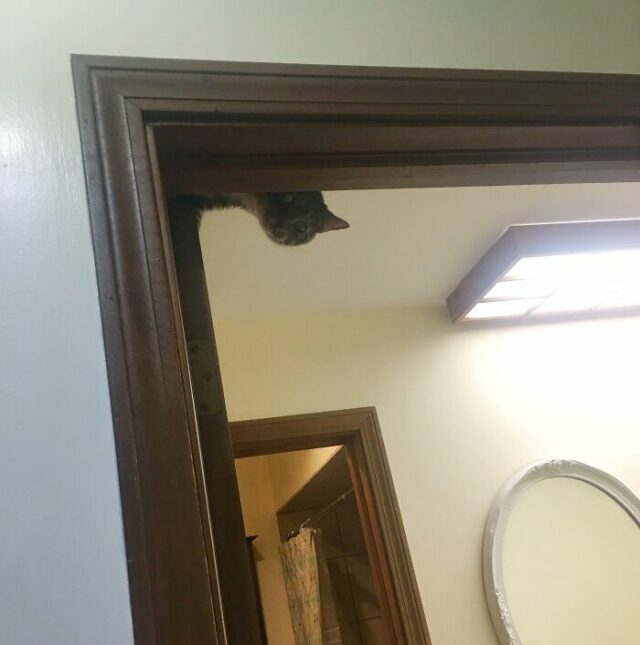
Locate an element on the screen. Image resolution: width=640 pixels, height=645 pixels. shower tiles is located at coordinates (330, 537), (352, 529), (340, 587), (360, 571), (356, 631), (371, 622).